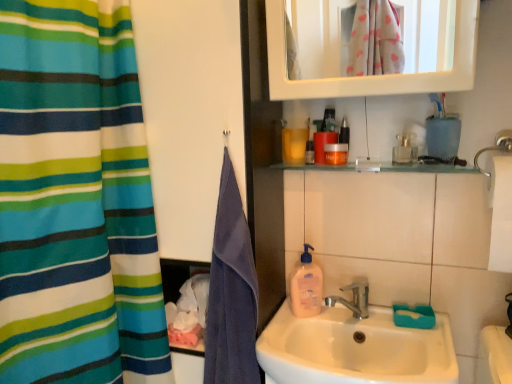
What are the coordinates of `free location to the right of translucent plastic bottle at upper center, the fourth mouthwash from the right` in the screenshot? It's located at (379, 162).